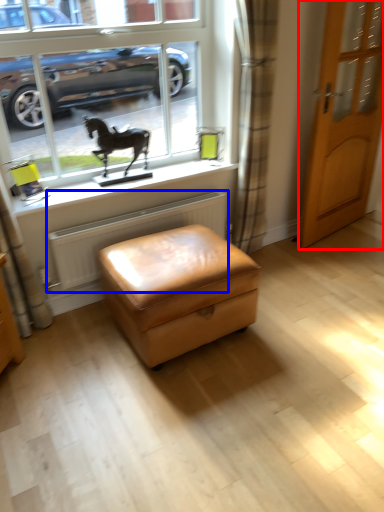
Question: Which point is closer to the camera, door (highlighted by a red box) or radiator (highlighted by a blue box)?

Choices:
 (A) door
 (B) radiator

Answer: (B)